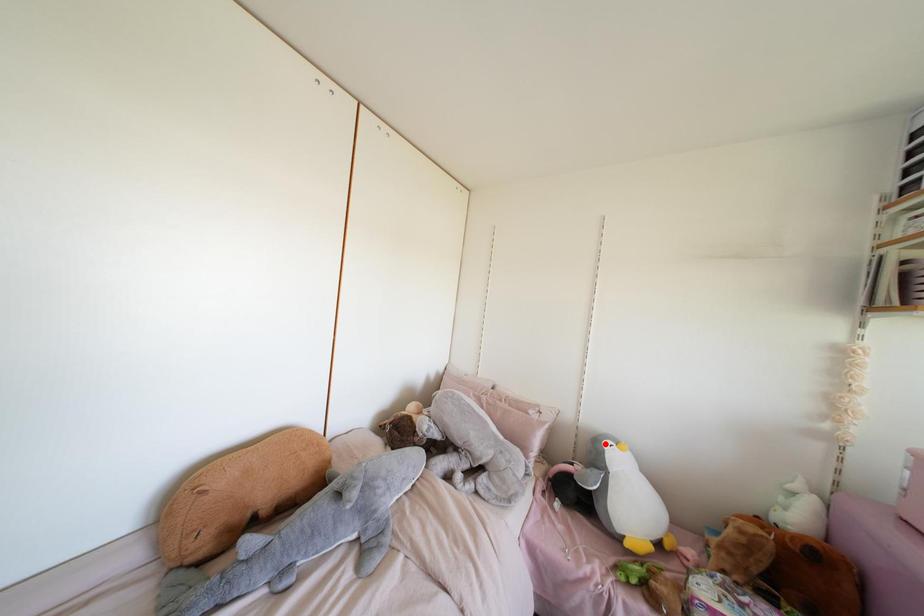
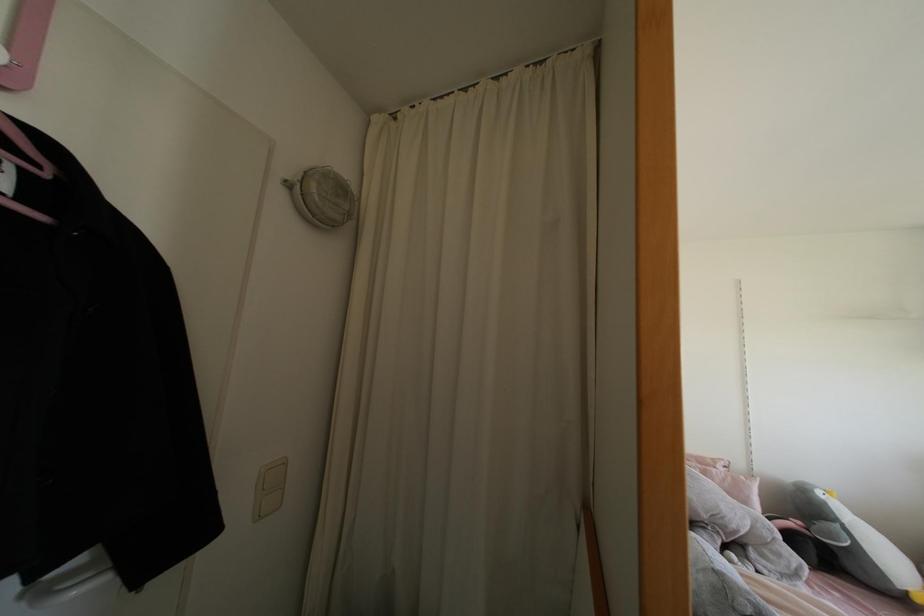
Question: I am providing you with two images of the same scene from different viewpoints. Image1 has a red point marked. In image2, the corresponding 3D location appears at what relative position? Reply with the corresponding letter.

Choices:
 (A) Closer
 (B) Farther

Answer: (A)